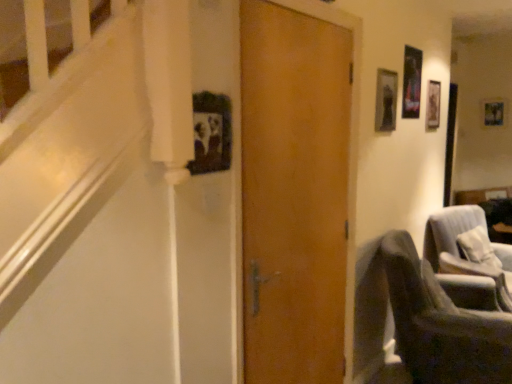
Question: Does metallic silver picture frame at upper right, the 1th picture frame positioned from the left, come in front of wooden photo frame at upper right, which is the 2th picture frame from front to back?

Choices:
 (A) no
 (B) yes

Answer: (B)

Question: Is metallic silver picture frame at upper right, the 1th picture frame positioned from the left, positioned behind wooden photo frame at upper right, placed as the 1th picture frame when sorted from top to bottom?

Choices:
 (A) yes
 (B) no

Answer: (B)

Question: From a real-world perspective, is metallic silver picture frame at upper right, placed as the 2th picture frame when sorted from back to front, positioned over wooden photo frame at upper right, marked as the 2th picture frame in a left-to-right arrangement, based on gravity?

Choices:
 (A) yes
 (B) no

Answer: (A)

Question: Is metallic silver picture frame at upper right, which is counted as the 1th picture frame, starting from the bottom, wider than wooden photo frame at upper right, the first picture frame from the right?

Choices:
 (A) yes
 (B) no

Answer: (A)

Question: Is metallic silver picture frame at upper right, placed as the 2th picture frame when sorted from back to front, beside wooden photo frame at upper right, which is the 2th picture frame from front to back?

Choices:
 (A) no
 (B) yes

Answer: (A)

Question: Looking at their shapes, would you say metallic silver picture frame at upper right, which is counted as the 1th picture frame, starting from the bottom, is wider or thinner than wooden photo frame at upper right, the first picture frame when ordered from back to front?

Choices:
 (A) thin
 (B) wide

Answer: (B)

Question: Which is correct: metallic silver picture frame at upper right, placed as the 2th picture frame when sorted from back to front, is inside wooden photo frame at upper right, which is the 2th picture frame in bottom-to-top order, or outside of it?

Choices:
 (A) inside
 (B) outside

Answer: (B)

Question: Does point (389, 117) appear closer or farther from the camera than point (500, 114)?

Choices:
 (A) closer
 (B) farther

Answer: (A)

Question: Considering the relative positions of metallic silver picture frame at upper right, which is counted as the second picture frame, starting from the right, and wooden photo frame at upper right, marked as the 2th picture frame in a left-to-right arrangement, in the image provided, is metallic silver picture frame at upper right, which is counted as the second picture frame, starting from the right, to the left or to the right of wooden photo frame at upper right, marked as the 2th picture frame in a left-to-right arrangement,?

Choices:
 (A) left
 (B) right

Answer: (A)

Question: Considering the positions of metallic silver picture frame at upper right, arranged as the 1th picture frame when viewed from the front, and dark gray fabric chair at lower right, acting as the second chair starting from the back, in the image, is metallic silver picture frame at upper right, arranged as the 1th picture frame when viewed from the front, taller or shorter than dark gray fabric chair at lower right, acting as the second chair starting from the back,?

Choices:
 (A) tall
 (B) short

Answer: (B)

Question: Is point (384, 74) closer or farther from the camera than point (422, 306)?

Choices:
 (A) farther
 (B) closer

Answer: (A)

Question: Considering the positions of metallic silver picture frame at upper right, which is counted as the 1th picture frame, starting from the bottom, and dark gray fabric chair at lower right, acting as the second chair starting from the back, in the image, is metallic silver picture frame at upper right, which is counted as the 1th picture frame, starting from the bottom, bigger or smaller than dark gray fabric chair at lower right, acting as the second chair starting from the back,?

Choices:
 (A) small
 (B) big

Answer: (A)

Question: Would you say metallic silver picture frame at upper right, arranged as the 1th picture frame when viewed from the front, is to the left or to the right of dark gray fabric chair at lower right, acting as the second chair starting from the back, in the picture?

Choices:
 (A) left
 (B) right

Answer: (A)

Question: Based on their sizes in the image, would you say wooden photo frame at upper right, which is the 2th picture frame in bottom-to-top order, is bigger or smaller than velvet gray armchair at lower right, which is the 2th chair from front to back?

Choices:
 (A) big
 (B) small

Answer: (B)

Question: Is point (487, 114) closer or farther from the camera than point (451, 264)?

Choices:
 (A) closer
 (B) farther

Answer: (B)